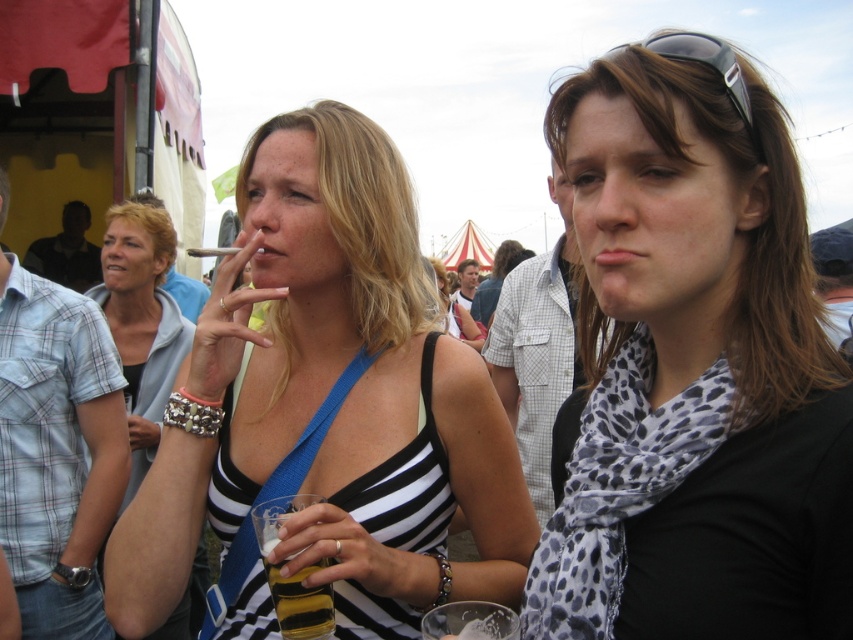
Question: Among these objects, which one is nearest to the camera?

Choices:
 (A) translucent yellow liquid at lower center
 (B) leopard print scarf at center

Answer: (B)

Question: Among these objects, which one is farthest from the camera?

Choices:
 (A) black plastic sunglasses at upper right
 (B) translucent yellow liquid at lower center

Answer: (B)

Question: Can you confirm if leopard print scarf at center is smaller than black and white striped bikini top at center?

Choices:
 (A) no
 (B) yes

Answer: (A)

Question: Can you confirm if black and white striped bikini top at center is positioned above black plastic sunglasses at upper right?

Choices:
 (A) yes
 (B) no

Answer: (B)

Question: Which point is closer to the camera taking this photo?

Choices:
 (A) (364, 344)
 (B) (726, 52)

Answer: (B)

Question: Is black and white striped bikini top at center above black plastic sunglasses at upper right?

Choices:
 (A) yes
 (B) no

Answer: (B)